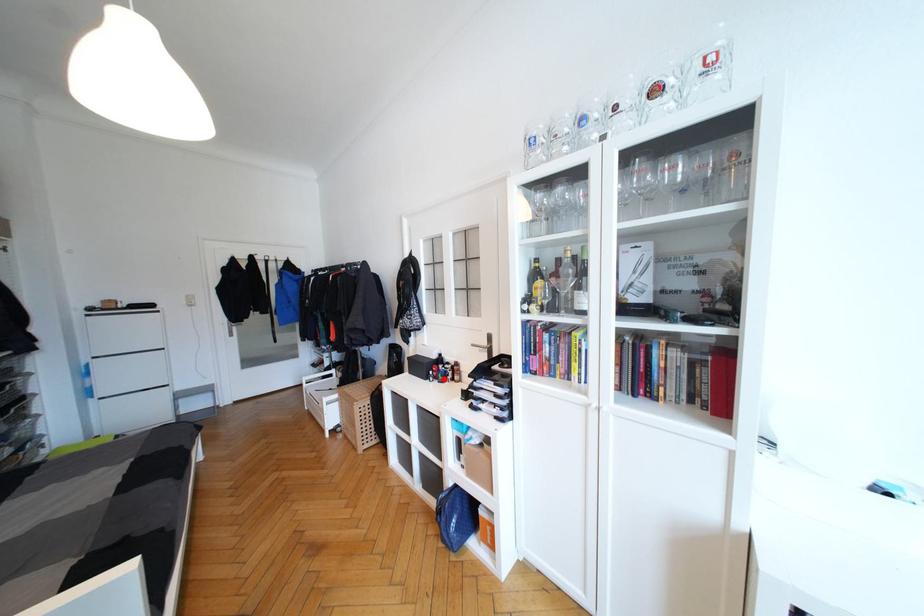
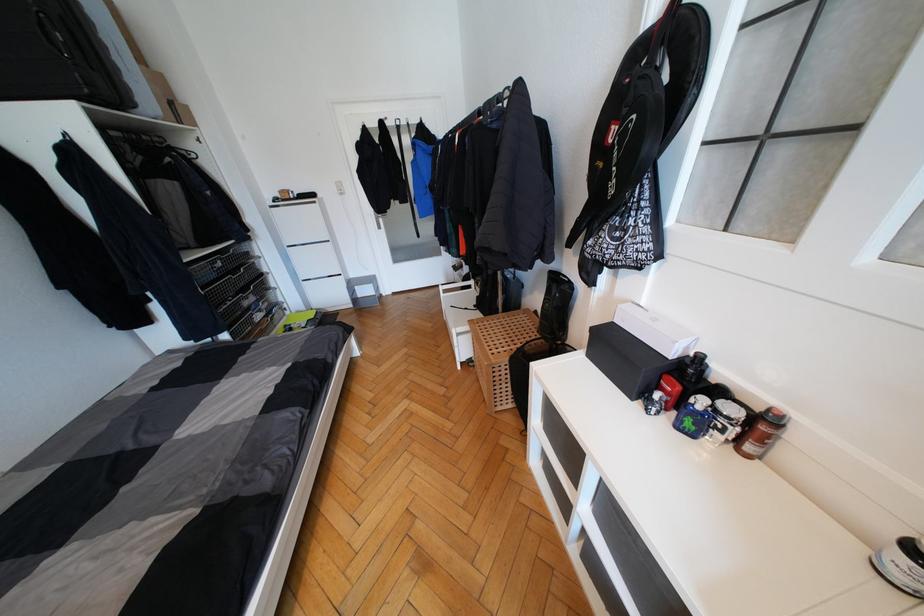
Where in the second image is the point corresponding to the highlighted location from the first image?

(691, 426)